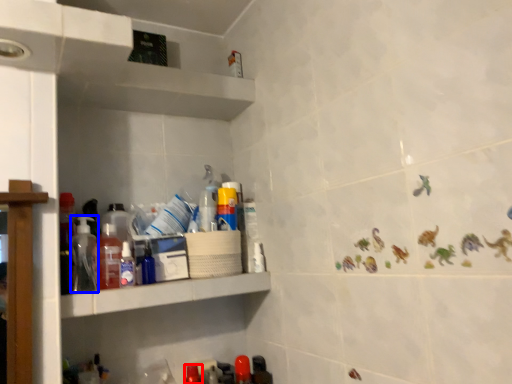
Question: Among these objects, which one is farthest to the camera, bottle (highlighted by a red box) or bottle (highlighted by a blue box)?

Choices:
 (A) bottle
 (B) bottle

Answer: (A)